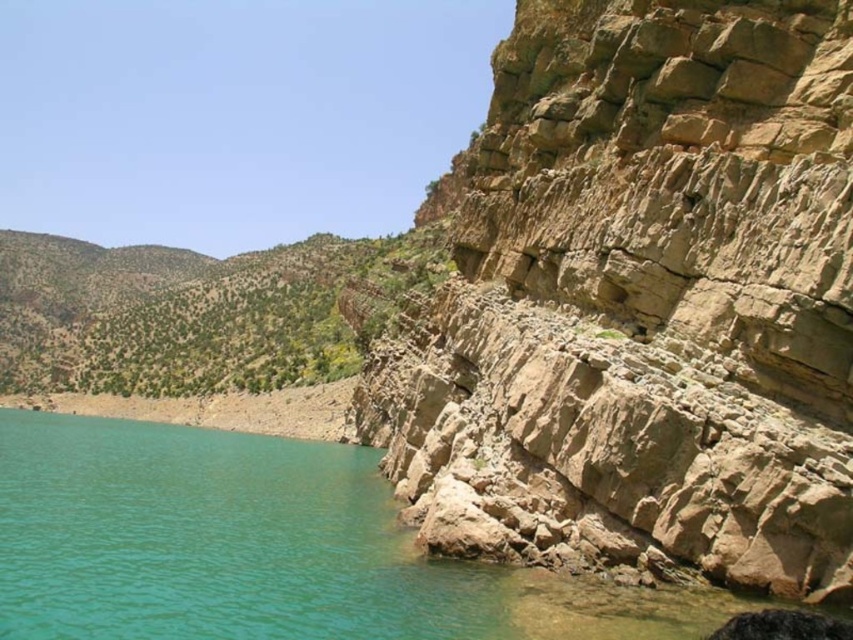
You are standing at the center of the image and want to cross to the other side. The path you choose must avoid the brown rough rock at right and the turquoise water at lower left. Given their widths, which obstacle should you go around first?

The brown rough rock at right has a lesser width compared to turquoise water at lower left, so you should go around the brown rough rock at right first since it is narrower and easier to navigate around before tackling the wider turquoise water at lower left.